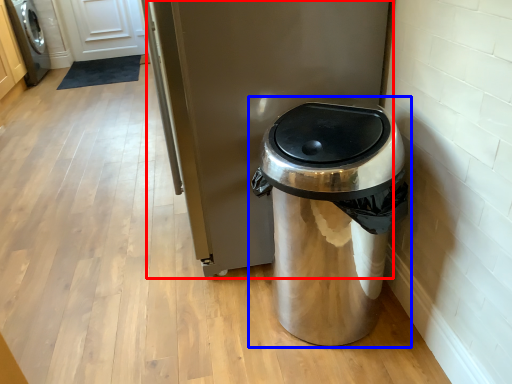
Question: Among these objects, which one is farthest to the camera, appliance (highlighted by a red box) or waste container (highlighted by a blue box)?

Choices:
 (A) appliance
 (B) waste container

Answer: (A)